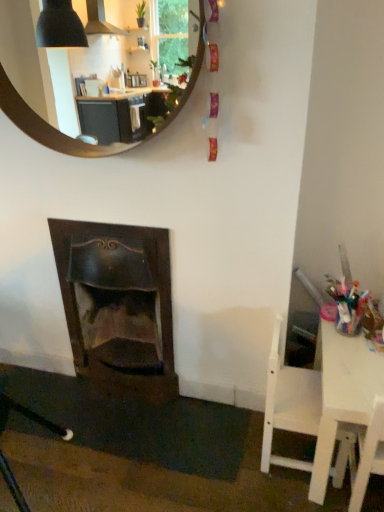
Measure the distance between point (270, 386) and camera.

A distance of 1.44 meters exists between point (270, 386) and camera.

At what (x,y) coordinates should I click in order to perform the action: click on white wood chair at lower right. Please return your answer as a coordinate pair (x, y). This screenshot has height=512, width=384. Looking at the image, I should click on (289, 404).

Where is `dark wood fireplace at lower left`? This screenshot has width=384, height=512. dark wood fireplace at lower left is located at coordinates (118, 304).

Where is `wooden round mirror at upper center`? wooden round mirror at upper center is located at coordinates (50, 127).

From a real-world perspective, between white plastic table at right and wooden round mirror at upper center, who is vertically lower?

white plastic table at right.

Considering the positions of objects white plastic table at right and wooden round mirror at upper center in the image provided, who is more to the left, white plastic table at right or wooden round mirror at upper center?

Positioned to the left is wooden round mirror at upper center.

You are a GUI agent. You are given a task and a screenshot of the screen. Output one action in this format:
    pyautogui.click(x=<x>, y=<y>)
    Task: Click on the mirror on the left side of white plastic table at right
    
    Given the screenshot: What is the action you would take?
    pyautogui.click(x=50, y=127)

Would you say white plastic table at right is outside wooden round mirror at upper center?

white plastic table at right lies outside wooden round mirror at upper center's area.

Based on their positions, is dark wood fireplace at lower left located to the left or right of white wood chair at lower right?

Clearly, dark wood fireplace at lower left is on the left of white wood chair at lower right in the image.

Locate an element on the screen. This screenshot has width=384, height=512. chair below the dark wood fireplace at lower left (from a real-world perspective) is located at coordinates (289, 404).

Is point (169, 359) positioned behind point (317, 423)?

Yes, it is.

Measure the distance from dark wood fireplace at lower left to white wood chair at lower right.

They are 25.55 inches apart.

Is dark wood fireplace at lower left at the back of wooden round mirror at upper center?

wooden round mirror at upper center is not turned away from dark wood fireplace at lower left.

From a real-world perspective, does wooden round mirror at upper center stand above dark wood fireplace at lower left?

Yes.

From the image's perspective, who appears lower, wooden round mirror at upper center or dark wood fireplace at lower left?

dark wood fireplace at lower left.

Locate an element on the screen. mirror that is in front of the dark wood fireplace at lower left is located at coordinates (50, 127).

Considering the relative sizes of wooden round mirror at upper center and white plastic table at right in the image provided, is wooden round mirror at upper center smaller than white plastic table at right?

Yes.

Is wooden round mirror at upper center far from white plastic table at right?

Absolutely, wooden round mirror at upper center is distant from white plastic table at right.

Considering the positions of objects wooden round mirror at upper center and white plastic table at right in the image provided, who is more to the right, wooden round mirror at upper center or white plastic table at right?

Positioned to the right is white plastic table at right.

Is wooden round mirror at upper center thinner than white plastic table at right?

Yes.

Is dark wood fireplace at lower left a part of white wood chair at lower right?

No, dark wood fireplace at lower left is not a part of white wood chair at lower right.

Is white wood chair at lower right positioned with its back to dark wood fireplace at lower left?

Yes, white wood chair at lower right is facing away from dark wood fireplace at lower left.

Are white wood chair at lower right and dark wood fireplace at lower left making contact?

No, white wood chair at lower right is not touching dark wood fireplace at lower left.

Is white wood chair at lower right at the right side of dark wood fireplace at lower left?

Yes, white wood chair at lower right is to the right of dark wood fireplace at lower left.

From the picture: Which object is wider, white plastic table at right or dark wood fireplace at lower left?

With larger width is white plastic table at right.

Which object is further away from the camera, white plastic table at right or dark wood fireplace at lower left?

dark wood fireplace at lower left is further from the camera.

Can we say white plastic table at right lies outside dark wood fireplace at lower left?

Absolutely, white plastic table at right is external to dark wood fireplace at lower left.

Is dark wood fireplace at lower left far away from white plastic table at right?

That's not correct — dark wood fireplace at lower left is a little close to white plastic table at right.

Is dark wood fireplace at lower left closer to the viewer compared to white plastic table at right?

No.

At what (x,y) coordinates should I click in order to perform the action: click on fireplace on the left of white plastic table at right. Please return your answer as a coordinate pair (x, y). This screenshot has width=384, height=512. Looking at the image, I should click on (118, 304).

Would you say dark wood fireplace at lower left is outside white plastic table at right?

Indeed, dark wood fireplace at lower left is completely outside white plastic table at right.

At what (x,y) coordinates should I click in order to perform the action: click on mirror in front of the white plastic table at right. Please return your answer as a coordinate pair (x, y). Looking at the image, I should click on (50, 127).

In order to click on fireplace on the left of the white wood chair at lower right in this screenshot , I will do `click(118, 304)`.

In the scene shown: Which object lies nearer to the anchor point white plastic table at right, white wood chair at lower right or dark wood fireplace at lower left?

white wood chair at lower right lies closer to white plastic table at right than the other object.

Considering their positions, is wooden round mirror at upper center positioned closer to dark wood fireplace at lower left than white wood chair at lower right?

wooden round mirror at upper center.

When comparing their distances from wooden round mirror at upper center, does white plastic table at right or dark wood fireplace at lower left seem closer?

Based on the image, dark wood fireplace at lower left appears to be nearer to wooden round mirror at upper center.

Estimate the real-world distances between objects in this image. Which object is closer to white plastic table at right, wooden round mirror at upper center or dark wood fireplace at lower left?

dark wood fireplace at lower left.

Looking at this image, which object lies nearer to the anchor point dark wood fireplace at lower left, white plastic table at right or white wood chair at lower right?

The object closer to dark wood fireplace at lower left is white wood chair at lower right.

From the image, which object appears to be farther from white wood chair at lower right, white plastic table at right or wooden round mirror at upper center?

wooden round mirror at upper center.

Considering their positions, is dark wood fireplace at lower left positioned further to white wood chair at lower right than white plastic table at right?

dark wood fireplace at lower left is positioned further to the anchor white wood chair at lower right.

From the image, which object appears to be nearer to dark wood fireplace at lower left, white wood chair at lower right or wooden round mirror at upper center?

wooden round mirror at upper center is positioned closer to the anchor dark wood fireplace at lower left.

At what (x,y) coordinates should I click in order to perform the action: click on chair between wooden round mirror at upper center and white plastic table at right vertically. Please return your answer as a coordinate pair (x, y). The height and width of the screenshot is (512, 384). Looking at the image, I should click on (289, 404).

You are a GUI agent. You are given a task and a screenshot of the screen. Output one action in this format:
    pyautogui.click(x=<x>, y=<y>)
    Task: Click on the fireplace between wooden round mirror at upper center and white wood chair at lower right vertically
    This screenshot has height=512, width=384.
    Given the screenshot: What is the action you would take?
    pyautogui.click(x=118, y=304)

The image size is (384, 512). Find the location of `chair between dark wood fireplace at lower left and white plastic table at right from left to right`. chair between dark wood fireplace at lower left and white plastic table at right from left to right is located at coordinates click(289, 404).

Locate an element on the screen. fireplace between wooden round mirror at upper center and white plastic table at right is located at coordinates (118, 304).